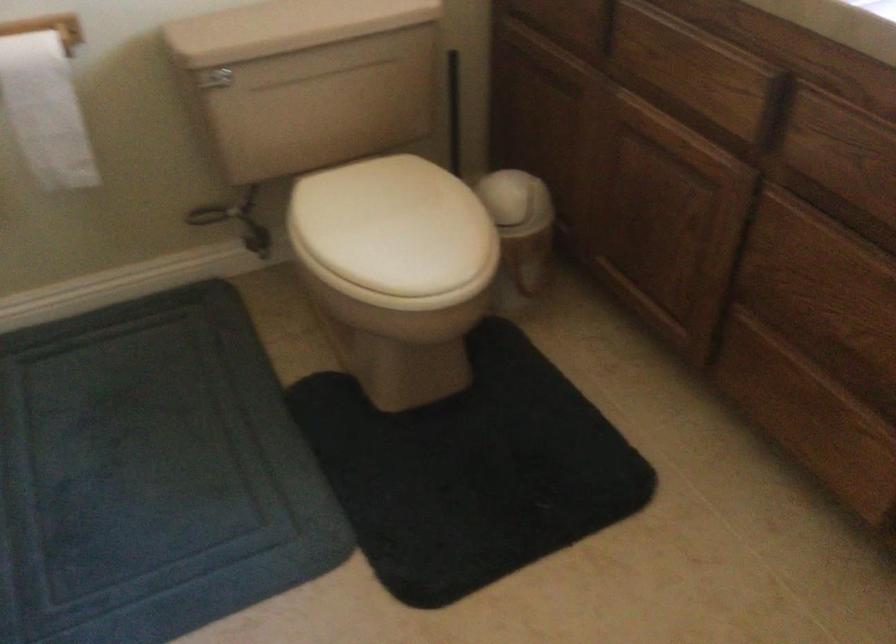
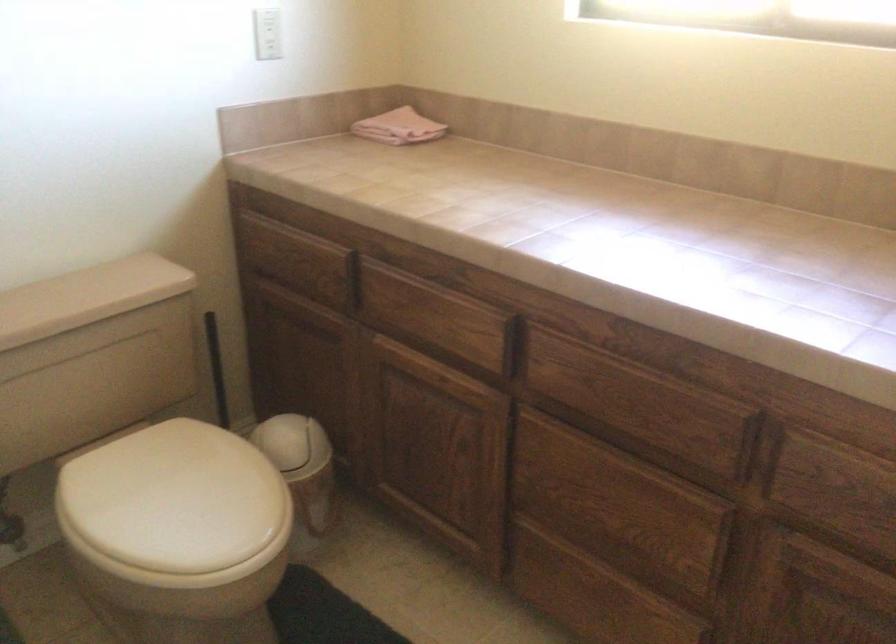
Find the pixel in the second image that matches point (512, 196) in the first image.

(293, 444)